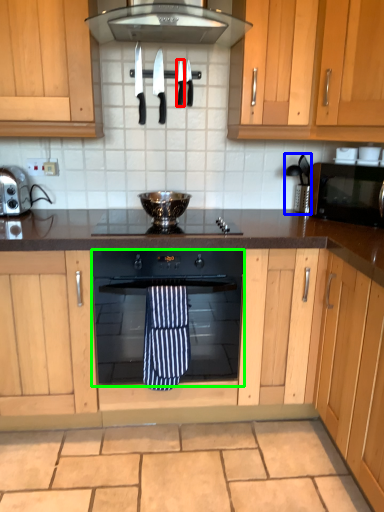
Question: Considering the real-world distances, which object is farthest from knife (highlighted by a red box)? coffee machine (highlighted by a blue box) or oven (highlighted by a green box)?

Choices:
 (A) coffee machine
 (B) oven

Answer: (B)